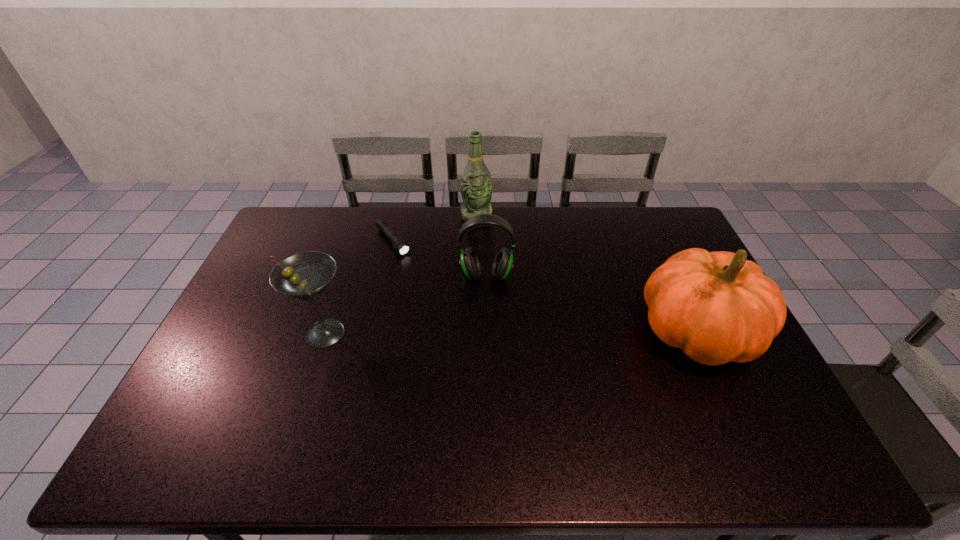
You are a GUI agent. You are given a task and a screenshot of the screen. Output one action in this format:
    pyautogui.click(x=<x>, y=<y>)
    Task: Click on the martini
    
    Given the screenshot: What is the action you would take?
    pyautogui.click(x=306, y=275)

Where is `the rightmost object`? The image size is (960, 540). the rightmost object is located at coordinates (717, 307).

Where is `headset`? headset is located at coordinates (470, 265).

You are a GUI agent. You are given a task and a screenshot of the screen. Output one action in this format:
    pyautogui.click(x=<x>, y=<y>)
    Task: Click on the third farthest object
    The width and height of the screenshot is (960, 540).
    Given the screenshot: What is the action you would take?
    pyautogui.click(x=470, y=265)

Locate an element on the screen. This screenshot has width=960, height=540. the shortest object is located at coordinates (399, 244).

Where is `beer bottle`? beer bottle is located at coordinates (476, 187).

This screenshot has height=540, width=960. In order to click on blank area located 0.090m on the back of the martini in this screenshot , I will do `click(339, 291)`.

I want to click on free space located 0.360m on the left of the pumpkin, so click(514, 334).

Where is `vacant space located on the ear cups of the third farthest object`? Image resolution: width=960 pixels, height=540 pixels. vacant space located on the ear cups of the third farthest object is located at coordinates (483, 368).

Find the location of a particular element. The width and height of the screenshot is (960, 540). free space located on the ear cups of the third farthest object is located at coordinates (483, 377).